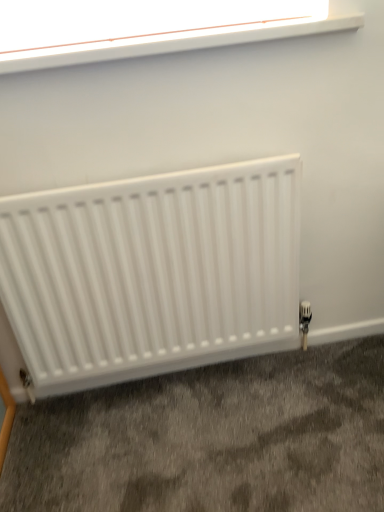
Image resolution: width=384 pixels, height=512 pixels. I want to click on white plastic window at upper center, so (148, 27).

Describe the element at coordinates (148, 27) in the screenshot. I see `white plastic window at upper center` at that location.

The height and width of the screenshot is (512, 384). What do you see at coordinates (152, 272) in the screenshot?
I see `white matte radiator at lower center` at bounding box center [152, 272].

Where is `white matte radiator at lower center`? white matte radiator at lower center is located at coordinates (152, 272).

In order to face white matte radiator at lower center, should I rotate leftwards or rightwards?

Turn left approximately 4.543 degrees to face it.

Locate an element on the screen. The width and height of the screenshot is (384, 512). white plastic window at upper center is located at coordinates (148, 27).

Is white plastic window at upper center at the right side of white matte radiator at lower center?

Yes.

Is the position of white plastic window at upper center less distant than that of white matte radiator at lower center?

Yes, the depth of white plastic window at upper center is less than that of white matte radiator at lower center.

Is point (15, 8) farther from viewer compared to point (62, 360)?

No, (15, 8) is in front of (62, 360).

In the scene shown: From the image's perspective, is white plastic window at upper center located above white matte radiator at lower center?

Yes, from the image's perspective, white plastic window at upper center is over white matte radiator at lower center.

From a real-world perspective, is white plastic window at upper center on white matte radiator at lower center?

Indeed, from a real-world perspective, white plastic window at upper center stands above white matte radiator at lower center.

Which object is thinner, white plastic window at upper center or white matte radiator at lower center?

white matte radiator at lower center is thinner.

From their relative heights in the image, would you say white plastic window at upper center is taller or shorter than white matte radiator at lower center?

In the image, white plastic window at upper center appears to be shorter than white matte radiator at lower center.

Looking at the image, does white plastic window at upper center seem bigger or smaller compared to white matte radiator at lower center?

Considering their sizes, white plastic window at upper center takes up less space than white matte radiator at lower center.

Would you say white plastic window at upper center is inside or outside white matte radiator at lower center?

white plastic window at upper center is outside white matte radiator at lower center.

Is white plastic window at upper center positioned far away from white matte radiator at lower center?

white plastic window at upper center is near white matte radiator at lower center, not far away.

Is white matte radiator at lower center at the back of white plastic window at upper center?

No, white plastic window at upper center is not facing away from white matte radiator at lower center.

How many degrees apart are the facing directions of white plastic window at upper center and white matte radiator at lower center?

They differ by 0.134 degrees in their facing directions.

Find the location of a particular element. The width and height of the screenshot is (384, 512). radiator directly beneath the white plastic window at upper center (from a real-world perspective) is located at coordinates (152, 272).

Consider the image. Between white matte radiator at lower center and white plastic window at upper center, which one appears on the right side from the viewer's perspective?

Positioned to the right is white plastic window at upper center.

Considering their positions, is white matte radiator at lower center located in front of or behind white plastic window at upper center?

Clearly, white matte radiator at lower center is behind white plastic window at upper center.

Is point (113, 370) behind point (84, 30)?

Yes.

From the image's perspective, who appears lower, white matte radiator at lower center or white plastic window at upper center?

white matte radiator at lower center is shown below in the image.

From a real-world perspective, is white matte radiator at lower center above or below white plastic window at upper center?

In terms of real-world spatial position, white matte radiator at lower center is below white plastic window at upper center.

Between white matte radiator at lower center and white plastic window at upper center, which one has larger width?

With larger width is white plastic window at upper center.

Does white matte radiator at lower center have a lesser height compared to white plastic window at upper center?

No.

Is white matte radiator at lower center smaller than white plastic window at upper center?

No, white matte radiator at lower center is not smaller than white plastic window at upper center.

Is white matte radiator at lower center situated inside white plastic window at upper center or outside?

white matte radiator at lower center is spatially situated outside white plastic window at upper center.

Is the surface of white matte radiator at lower center in direct contact with white plastic window at upper center?

They are not placed beside each other.

Is white matte radiator at lower center facing towards white plastic window at upper center?

No, white matte radiator at lower center is not turned towards white plastic window at upper center.

Can you tell me how much white matte radiator at lower center and white plastic window at upper center differ in facing direction?

white matte radiator at lower center and white plastic window at upper center are facing 0.134 degrees away from each other.

At what (x,y) coordinates should I click in order to perform the action: click on radiator that is under the white plastic window at upper center (from a real-world perspective). Please return your answer as a coordinate pair (x, y). This screenshot has width=384, height=512. Looking at the image, I should click on (152, 272).

Where is `window that is in front of the white matte radiator at lower center`? The image size is (384, 512). window that is in front of the white matte radiator at lower center is located at coordinates (148, 27).

This screenshot has width=384, height=512. What are the coordinates of `window that is above the white matte radiator at lower center (from the image's perspective)` in the screenshot? It's located at [148, 27].